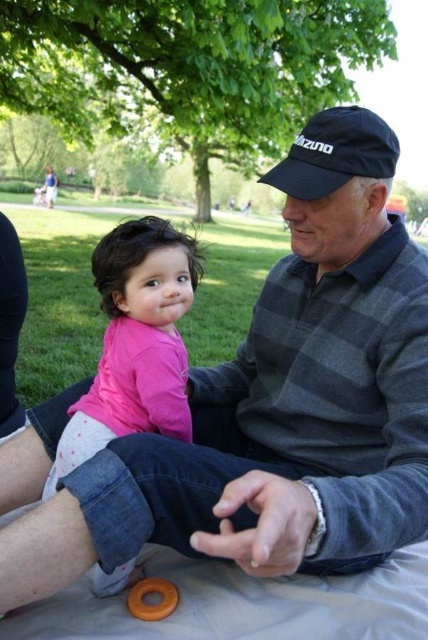
You are a photographer trying to capture a candid shot of the scene. You want to ensure that both the pink matte shirt at center and the black fabric baseball cap at upper center are in focus. Given that your camera can only focus on objects within a 20 inch range, will both items be in focus?

The pink matte shirt at center is 23.59 inches away from the black fabric baseball cap at upper center. Since the distance between them exceeds the camera focus range of 20 inches, both items cannot be in focus simultaneously.

You are a photographer trying to capture a candid shot of the scene. You notice the pink matte shirt at center and the black fabric baseball cap at upper center. Which object should you focus on first to ensure both are in the frame?

The pink matte shirt at center is in front of the black fabric baseball cap at upper center, so focusing on the pink matte shirt at center first will ensure both are in the frame.